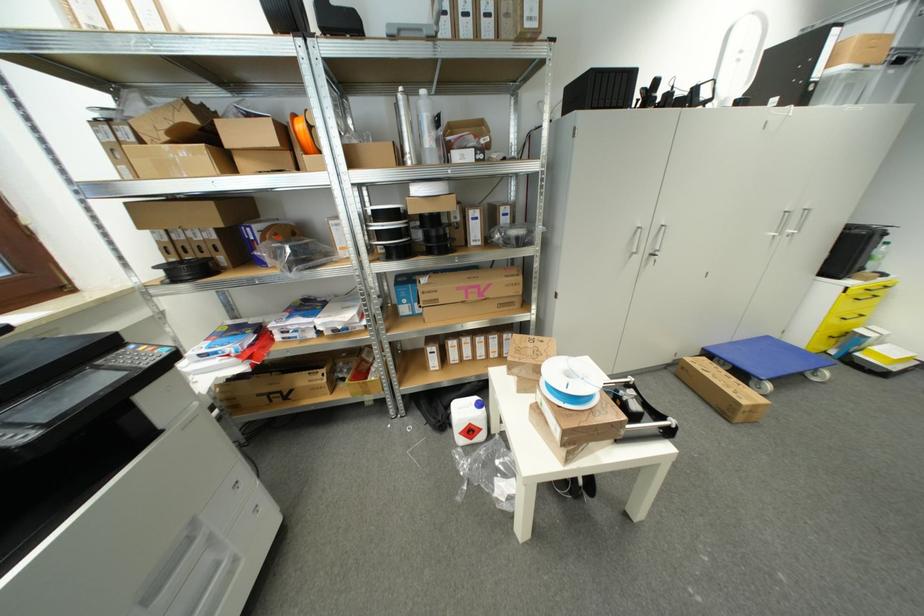
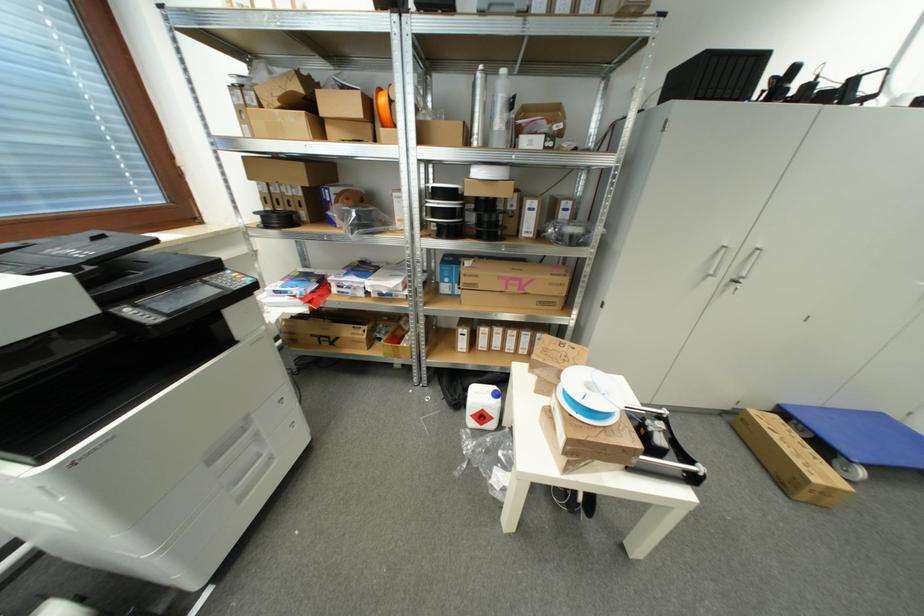
Where in the second image is the point corresponding to point (772, 339) from the first image?

(885, 418)